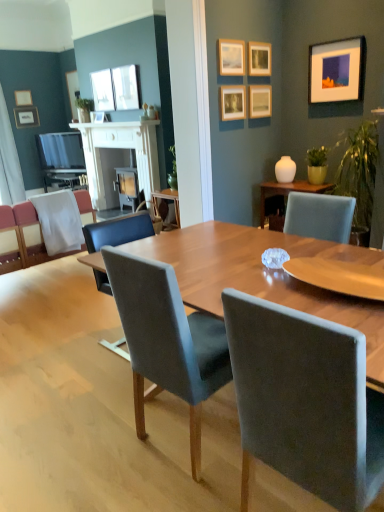
Find the location of `free spot to the left of fabric upholstered chair at center, positioned as the 2th chair in left-to-right order`. free spot to the left of fabric upholstered chair at center, positioned as the 2th chair in left-to-right order is located at coordinates (99, 443).